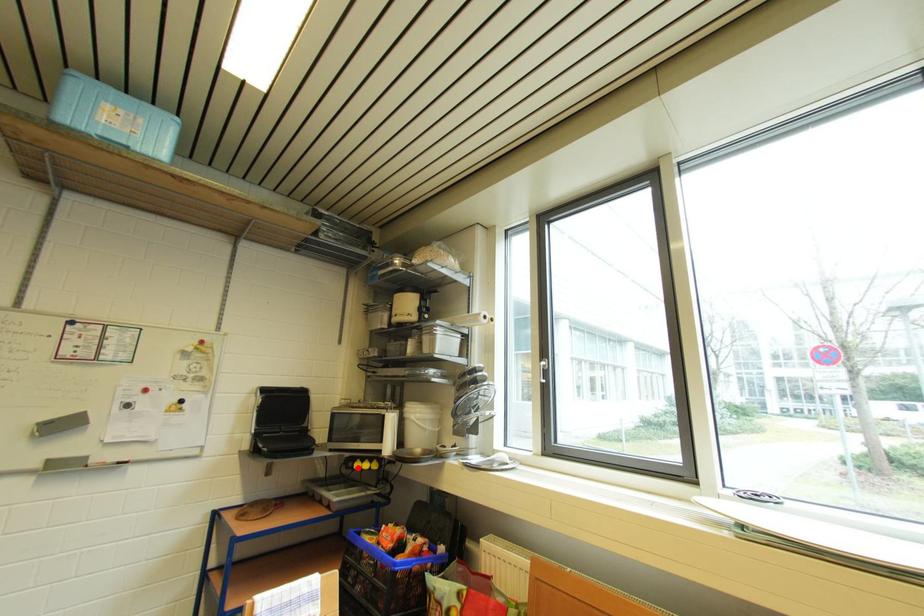
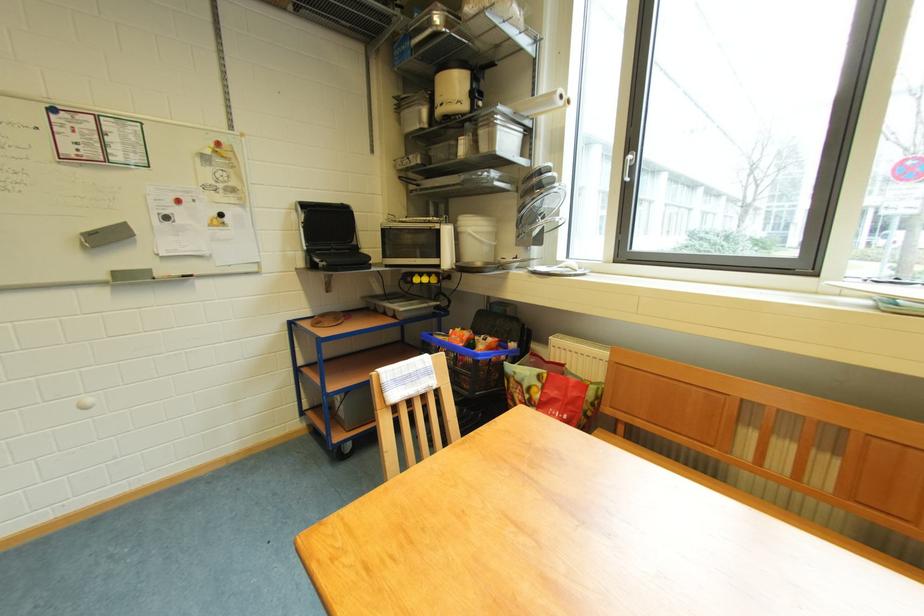
Find the pixel in the second image that matches the highlighted location in the first image.

(417, 282)